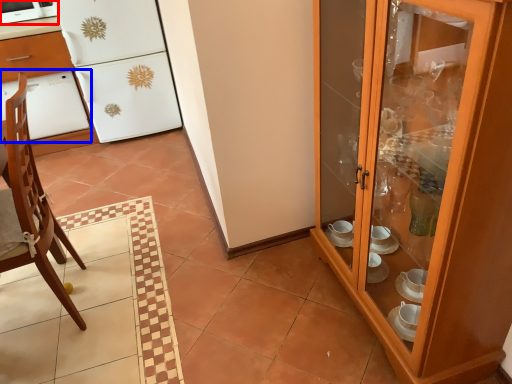
Question: Which object appears farthest to the camera in this image, home appliance (highlighted by a red box) or oven (highlighted by a blue box)?

Choices:
 (A) home appliance
 (B) oven

Answer: (B)